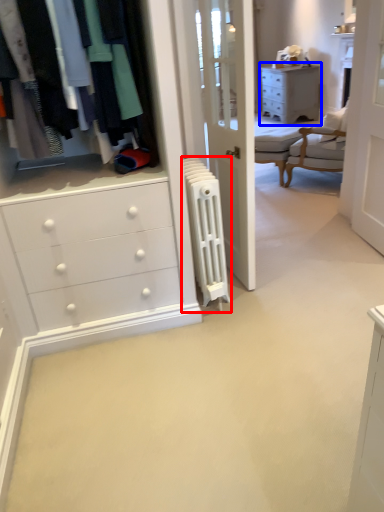
Question: Which of the following is the farthest to the observer, radiator (highlighted by a red box) or chest of drawers (highlighted by a blue box)?

Choices:
 (A) radiator
 (B) chest of drawers

Answer: (B)